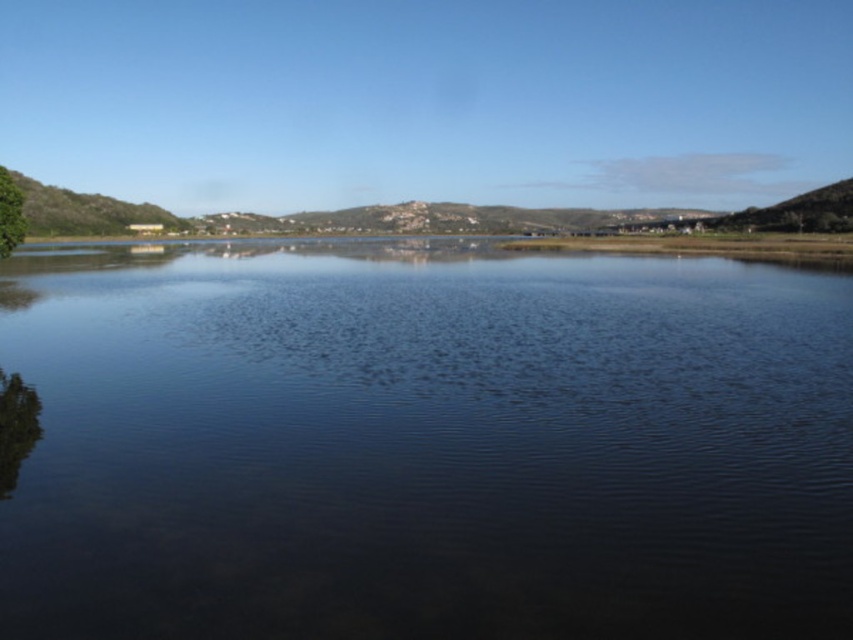
Which is more to the right, transparent water at center or green leafy tree at left?

Positioned to the right is transparent water at center.

Between point (457, 268) and point (18, 204), which one is positioned behind?

The point (457, 268) is more distant.

Locate an element on the screen. This screenshot has width=853, height=640. transparent water at center is located at coordinates (424, 444).